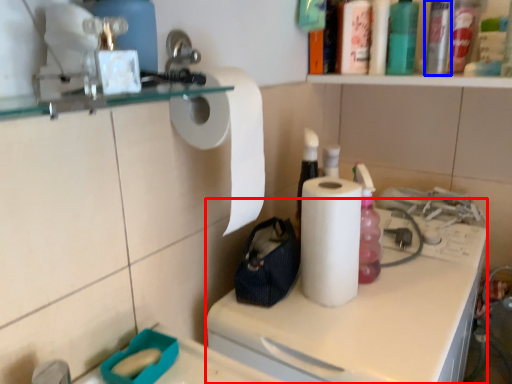
Question: Among these objects, which one is farthest to the camera, counter (highlighted by a red box) or bottle (highlighted by a blue box)?

Choices:
 (A) counter
 (B) bottle

Answer: (B)